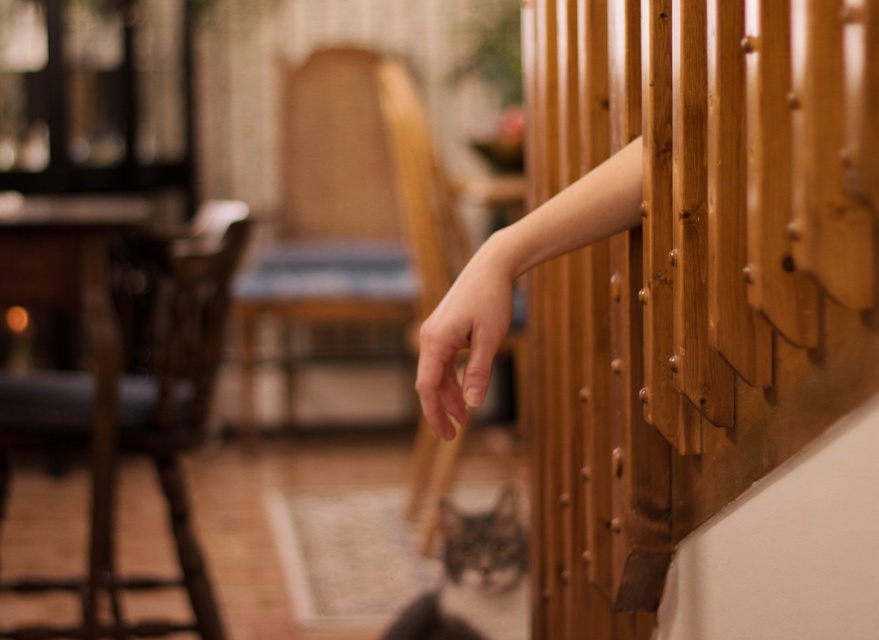
Is wooden at right positioned at the back of gray fur cat at lower center?

No.

Who is more forward, (874, 93) or (525, 563)?

Point (874, 93) is more forward.

What are the coordinates of `wooden at right` in the screenshot? It's located at (691, 275).

Which is more to the left, pale skin arm at upper right or pale skin hand at center?

Positioned to the left is pale skin hand at center.

Between pale skin arm at upper right and pale skin hand at center, which one has less height?

pale skin hand at center is shorter.

Where is `pale skin arm at upper right`? Image resolution: width=879 pixels, height=640 pixels. pale skin arm at upper right is located at coordinates (513, 280).

In the scene shown: Can you confirm if gray fur cat at lower center is shorter than pale skin hand at center?

In fact, gray fur cat at lower center may be taller than pale skin hand at center.

Consider the image. Who is more forward, (x=459, y=548) or (x=482, y=378)?

Point (x=482, y=378)

Which is in front, point (445, 561) or point (485, 340)?

Point (485, 340) is in front.

Where is `gray fur cat at lower center`? The height and width of the screenshot is (640, 879). gray fur cat at lower center is located at coordinates (471, 572).